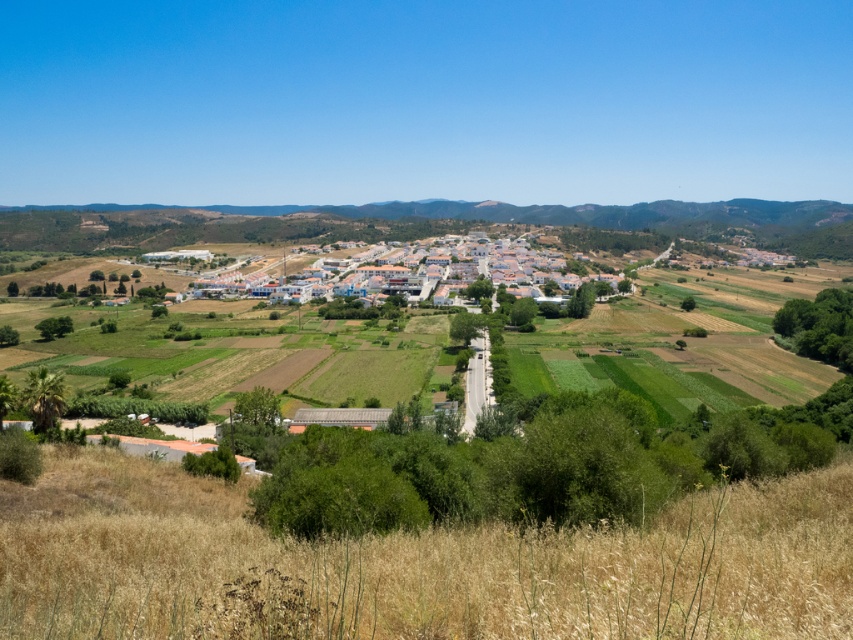
Question: Which of the following is the closest to the observer?

Choices:
 (A) [412, 276]
 (B) [73, 561]

Answer: (B)

Question: Does dry grass at lower center have a greater width compared to white matte buildings at center?

Choices:
 (A) no
 (B) yes

Answer: (A)

Question: Which of the following is the farthest from the observer?

Choices:
 (A) (811, 605)
 (B) (463, 266)

Answer: (B)

Question: Is dry grass at lower center bigger than white matte buildings at center?

Choices:
 (A) no
 (B) yes

Answer: (A)

Question: In this image, where is dry grass at lower center located relative to white matte buildings at center?

Choices:
 (A) right
 (B) left

Answer: (A)